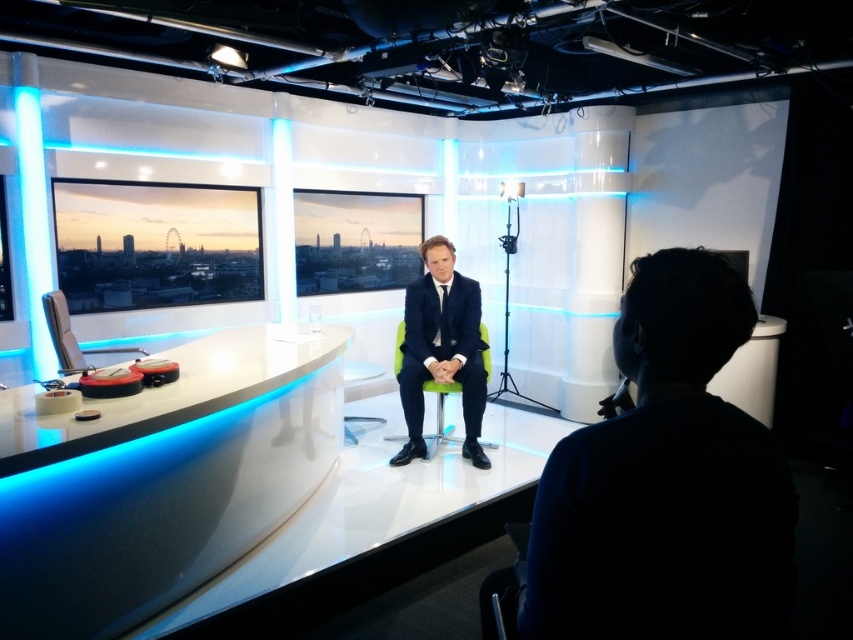
Between point (465, 371) and point (488, 360), which one is positioned behind?

The point (488, 360) is more distant.

Which is more to the right, navy blue suit at center or green fabric chair at center?

Positioned to the right is navy blue suit at center.

The height and width of the screenshot is (640, 853). Describe the element at coordinates (440, 348) in the screenshot. I see `navy blue suit at center` at that location.

The height and width of the screenshot is (640, 853). Identify the location of navy blue suit at center. (440, 348).

Who is taller, matte black chair at left or green fabric chair at center?

Standing taller between the two is green fabric chair at center.

Where is `matte black chair at left`? This screenshot has width=853, height=640. matte black chair at left is located at coordinates (71, 337).

Identify the location of matte black chair at left. The image size is (853, 640). (71, 337).

Can you confirm if dark blue fabric at center is shorter than navy blue suit at center?

Yes, dark blue fabric at center is shorter than navy blue suit at center.

The height and width of the screenshot is (640, 853). What do you see at coordinates (666, 483) in the screenshot?
I see `dark blue fabric at center` at bounding box center [666, 483].

Image resolution: width=853 pixels, height=640 pixels. Identify the location of dark blue fabric at center. click(x=666, y=483).